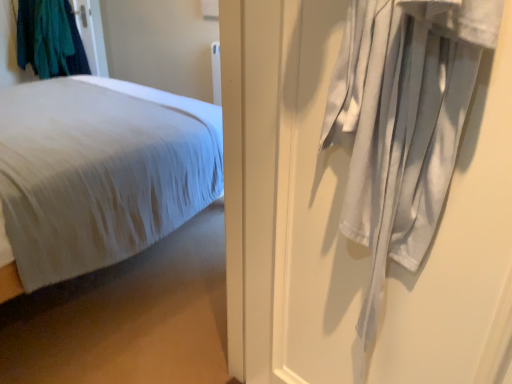
Question: Does point (435, 21) appear closer or farther from the camera than point (36, 251)?

Choices:
 (A) farther
 (B) closer

Answer: (B)

Question: Relative to white soft bed at left, is white cotton curtain at right in front or behind?

Choices:
 (A) front
 (B) behind

Answer: (A)

Question: Based on their relative distances, which object is nearer to the teal fabric at upper left?

Choices:
 (A) white soft bed at left
 (B) white cotton curtain at right

Answer: (A)

Question: Which is nearer to the white cotton curtain at right?

Choices:
 (A) white soft bed at left
 (B) teal fabric at upper left

Answer: (A)